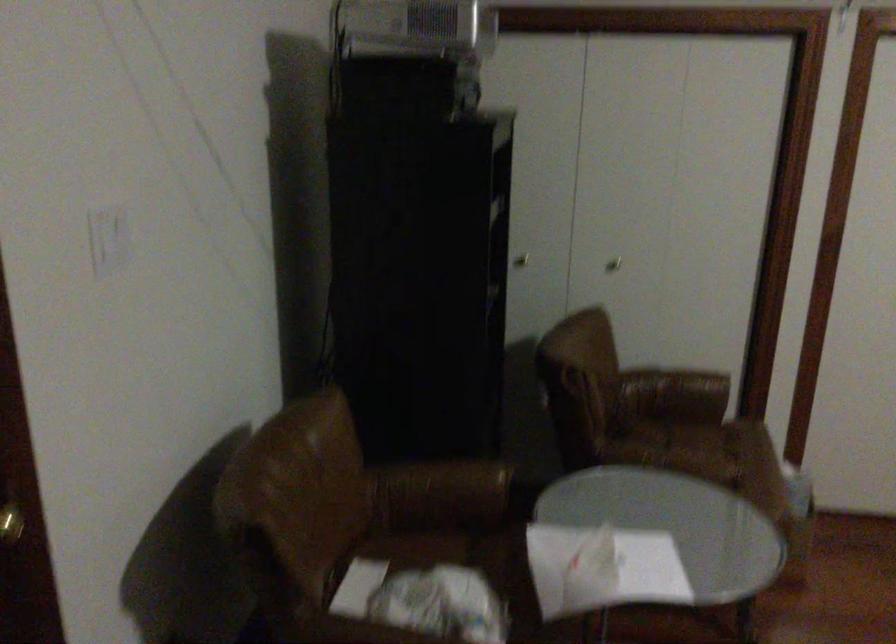
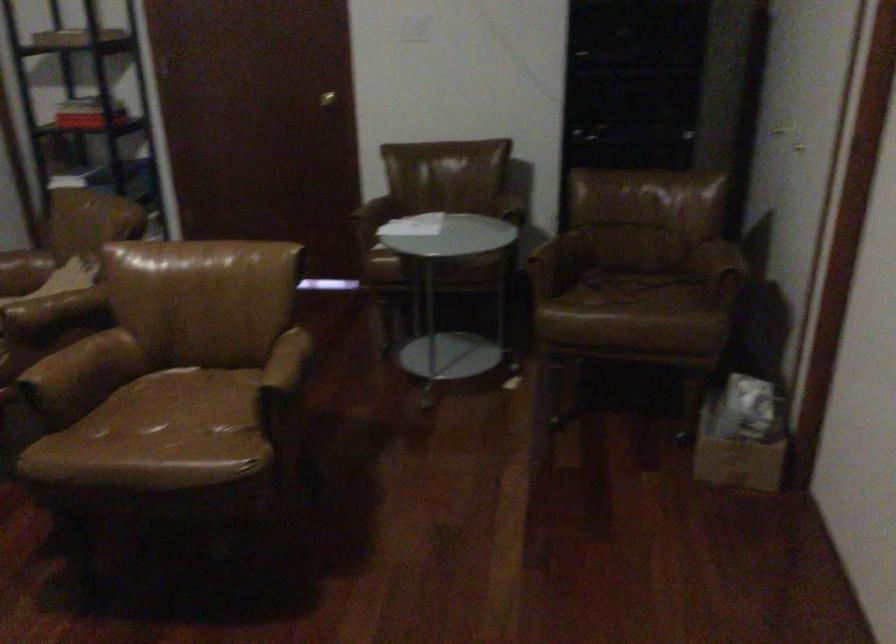
The point at (810, 496) is marked in the first image. Where is the corresponding point in the second image?

(742, 436)